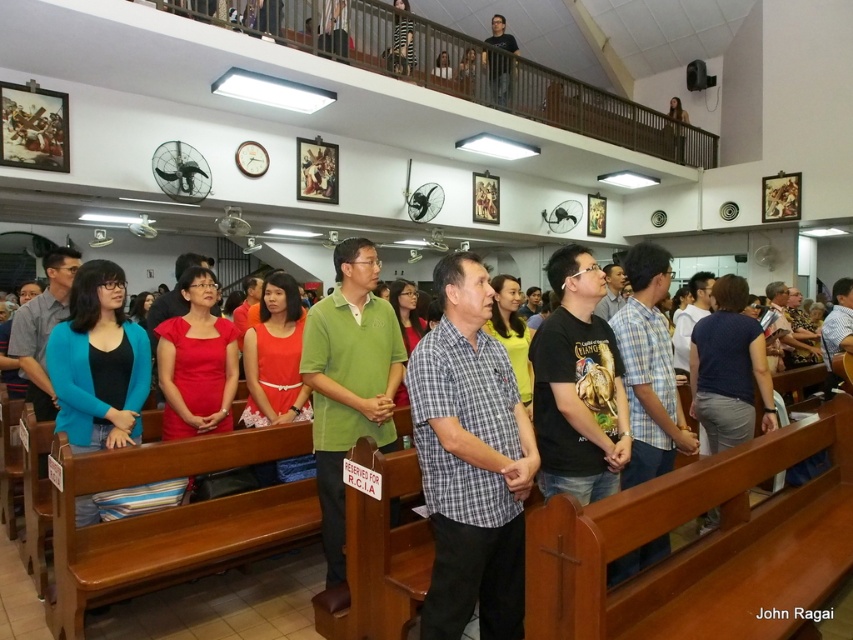
Question: Which object appears closest to the camera in this image?

Choices:
 (A) black matte shirt at upper center
 (B) green matte shirt at center

Answer: (B)

Question: Where is gray checkered shirt at center located in relation to green matte shirt at center in the image?

Choices:
 (A) below
 (B) above

Answer: (A)

Question: Which object is the closest to the green matte shirt at center?

Choices:
 (A) black matte shirt at upper center
 (B) gray checkered shirt at center

Answer: (B)

Question: Does gray checkered shirt at center have a larger size compared to green matte shirt at center?

Choices:
 (A) yes
 (B) no

Answer: (B)

Question: Can you confirm if gray checkered shirt at center is positioned below black matte shirt at upper center?

Choices:
 (A) no
 (B) yes

Answer: (B)

Question: Which point is farther from the camera taking this photo?

Choices:
 (A) (485, 577)
 (B) (303, 355)

Answer: (B)